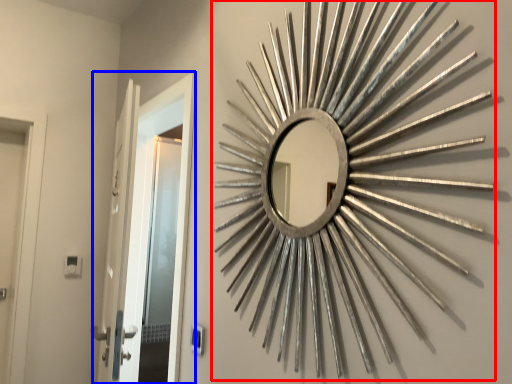
Question: Which of the following is the closest to the observer, brass (highlighted by a red box) or door (highlighted by a blue box)?

Choices:
 (A) brass
 (B) door

Answer: (A)